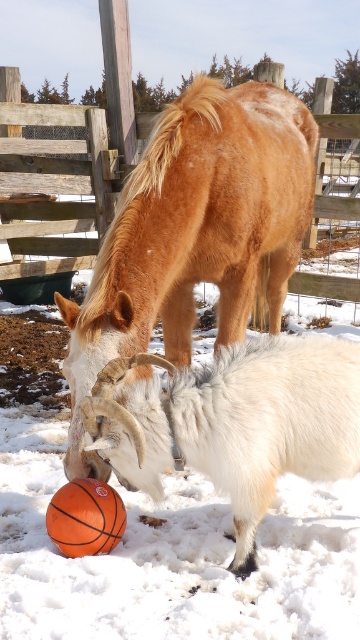
Is point (240, 358) positioned after point (65, 538)?

No, (240, 358) is in front of (65, 538).

Does white woolen goat at lower center have a greater height compared to orange rubber basketball at lower center?

Yes, white woolen goat at lower center is taller than orange rubber basketball at lower center.

Does point (191, 458) come farther from viewer compared to point (69, 492)?

No.

Image resolution: width=360 pixels, height=640 pixels. I want to click on white woolen goat at lower center, so click(x=236, y=422).

Is point (277, 243) positioned in front of point (312, 472)?

No.

Which is more to the right, brown fuzzy horse at center or white woolen goat at lower center?

Positioned to the right is white woolen goat at lower center.

Which is in front, point (186, 218) or point (158, 396)?

Point (158, 396) is in front.

Where is `brown fuzzy horse at center`? The image size is (360, 640). brown fuzzy horse at center is located at coordinates (195, 232).

Measure the distance between brown fuzzy horse at center and orange rubber basketball at lower center.

The distance of brown fuzzy horse at center from orange rubber basketball at lower center is 29.25 inches.

Which is behind, point (168, 307) or point (84, 536)?

The point (168, 307) is more distant.

Identify the location of brown fuzzy horse at center. This screenshot has height=640, width=360. (195, 232).